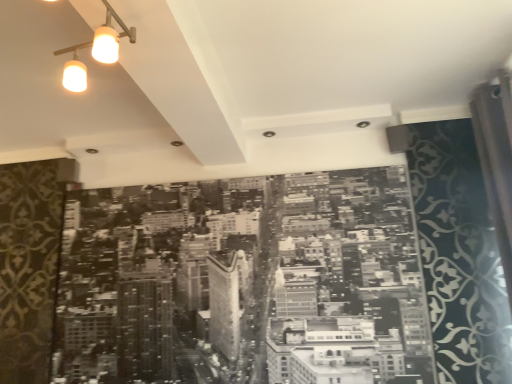
Looking at this image, measure the distance between point (342, 288) and camera.

Point (342, 288) and camera are 7.36 feet apart.

Locate an element on the screen. The image size is (512, 384). black/white paper at center is located at coordinates (237, 280).

Image resolution: width=512 pixels, height=384 pixels. Describe the element at coordinates (237, 280) in the screenshot. I see `black/white paper at center` at that location.

Find the location of a particular element. The width and height of the screenshot is (512, 384). black/white paper at center is located at coordinates (237, 280).